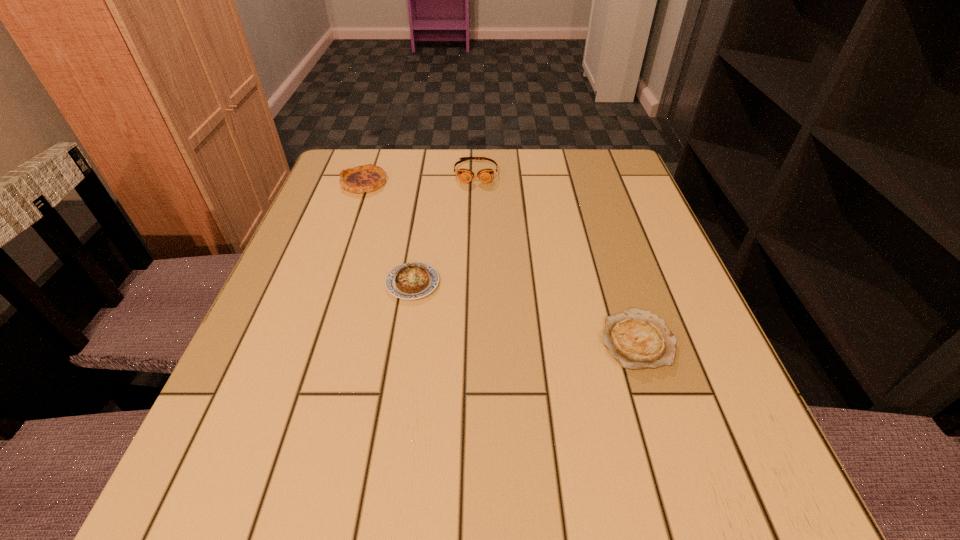
Identify the location of free space at the right edge. (616, 228).

What are the coordinates of `vacant position at the near left corner of the desktop` in the screenshot? It's located at (254, 496).

The width and height of the screenshot is (960, 540). I want to click on free region at the far right corner, so click(x=623, y=156).

You are a GUI agent. You are given a task and a screenshot of the screen. Output one action in this format:
    pyautogui.click(x=<x>, y=<y>)
    Task: Click on the vacant area between the third object from right to left and the rightmost object
    This screenshot has height=540, width=960.
    Given the screenshot: What is the action you would take?
    pyautogui.click(x=524, y=311)

You are a GUI agent. You are given a task and a screenshot of the screen. Output one action in this format:
    pyautogui.click(x=<x>, y=<y>)
    Task: Click on the vacant area that lies between the goggles and the third shortest object
    This screenshot has height=540, width=960.
    Given the screenshot: What is the action you would take?
    pyautogui.click(x=420, y=177)

The image size is (960, 540). Identify the location of free spot between the second nearest object and the rightmost quiche. (524, 311).

Find the location of a particular element. The height and width of the screenshot is (540, 960). free space between the goggles and the rightmost quiche is located at coordinates (556, 255).

Where is `free area in between the leftmost object and the second object from right to left`? This screenshot has width=960, height=540. free area in between the leftmost object and the second object from right to left is located at coordinates (420, 177).

Where is `vacant area between the tallest quiche and the nearest object`? This screenshot has height=540, width=960. vacant area between the tallest quiche and the nearest object is located at coordinates (500, 261).

Find the location of a particular element. The height and width of the screenshot is (540, 960). vacant area that lies between the second nearest quiche and the second object from right to left is located at coordinates (444, 227).